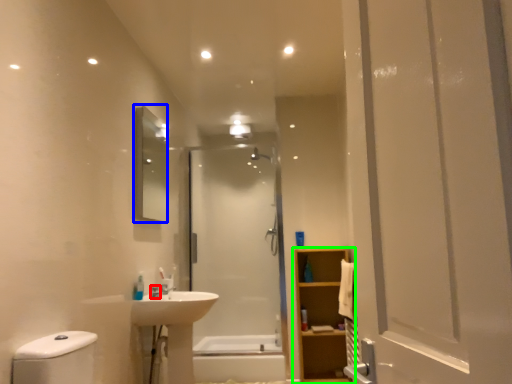
Question: Which object is the farthest from plumbing fixture (highlighted by a red box)? Choose among these: mirror (highlighted by a blue box) or bathroom cabinet (highlighted by a green box).

Choices:
 (A) mirror
 (B) bathroom cabinet

Answer: (B)